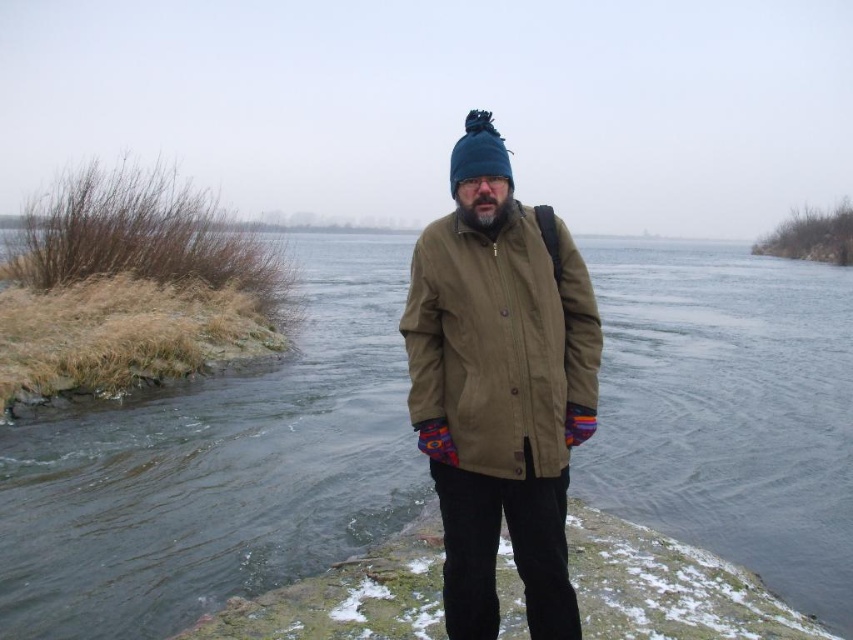
Question: Which point is closer to the camera taking this photo?

Choices:
 (A) (509, 176)
 (B) (428, 417)

Answer: (B)

Question: Observing the image, what is the correct spatial positioning of olive-green fabric coat at center in reference to blue fuzzy beanie at center?

Choices:
 (A) left
 (B) right

Answer: (B)

Question: Can you confirm if olive-green fabric coat at center is positioned to the right of blue fuzzy beanie at center?

Choices:
 (A) no
 (B) yes

Answer: (B)

Question: Is olive-green fabric coat at center wider than blue fuzzy beanie at center?

Choices:
 (A) no
 (B) yes

Answer: (B)

Question: Among these points, which one is farthest from the camera?

Choices:
 (A) (480, 113)
 (B) (505, 154)

Answer: (A)